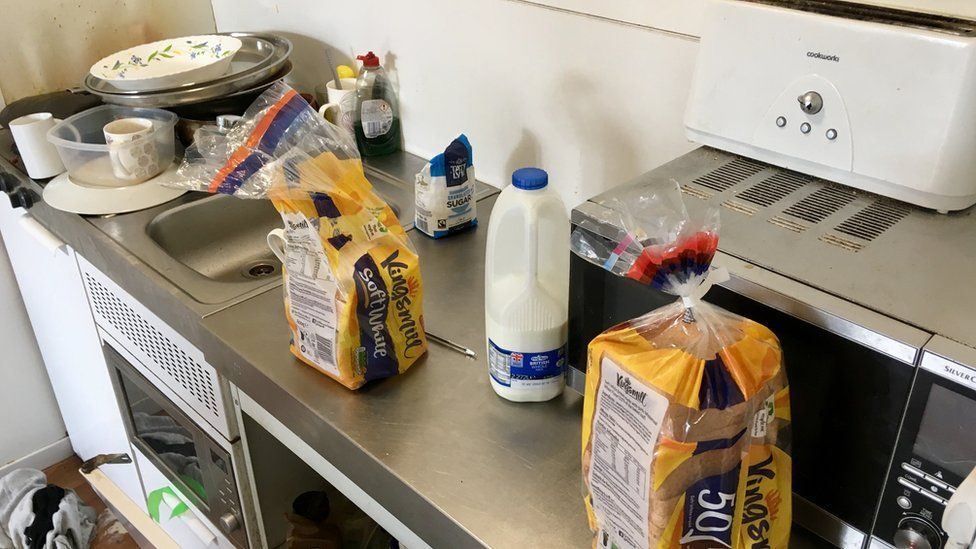
Locate an element on the screen. The height and width of the screenshot is (549, 976). sink is located at coordinates (192, 244), (228, 232), (232, 274).